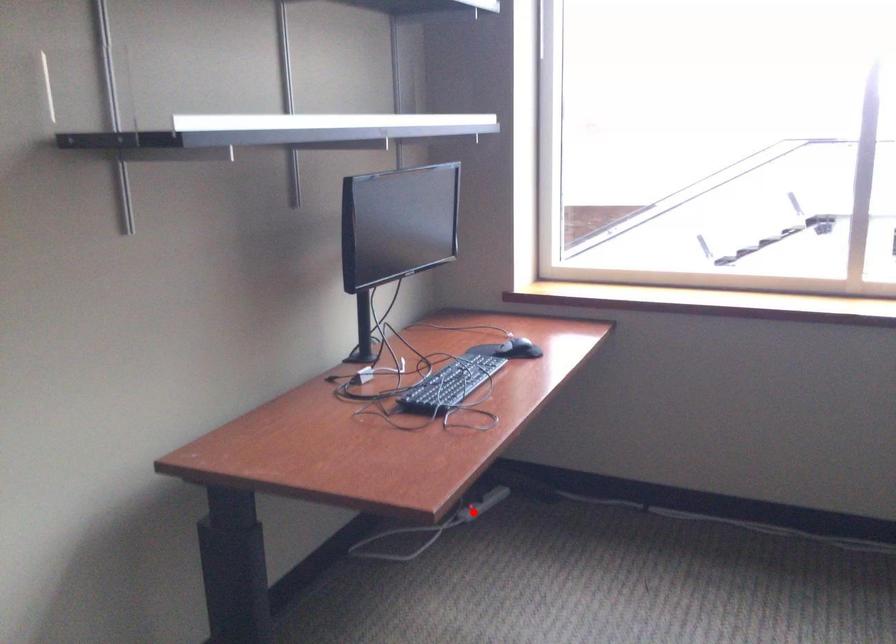
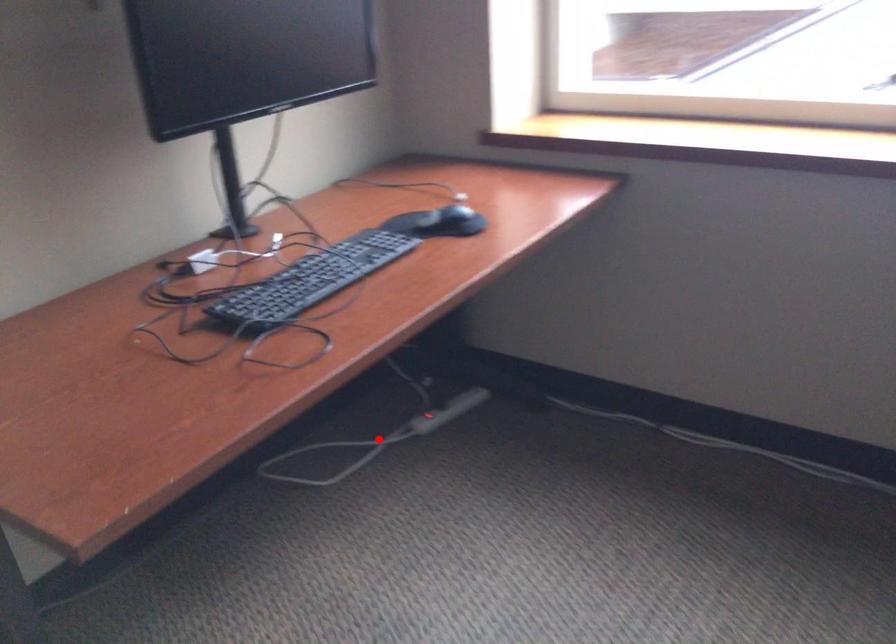
I am providing you with two images of the same scene from different viewpoints. A red point is marked on the first image and another point is marked on the second image. Is the marked point in image1 the same physical position as the marked point in image2?

No